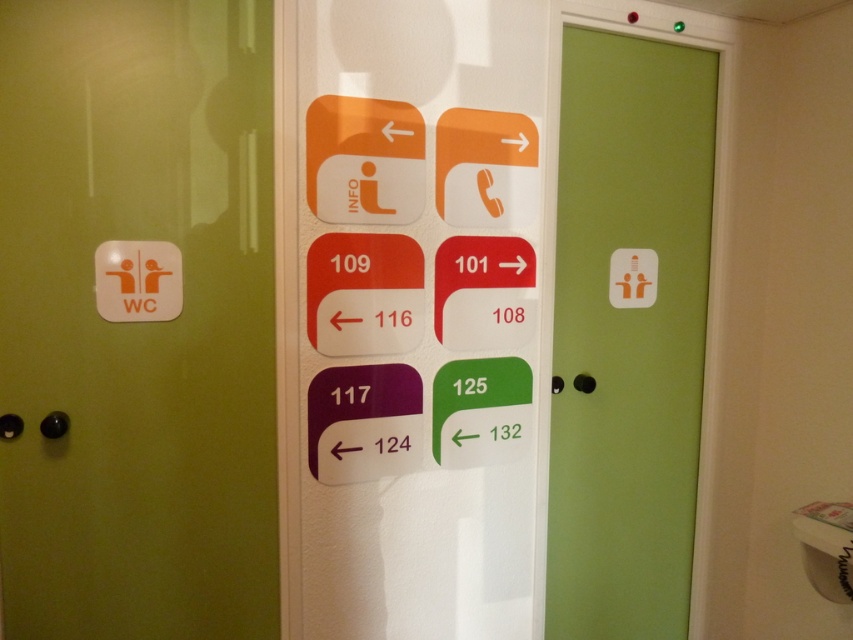
Between green matte wc sign at left and green matte door at center, which one has less height?

green matte wc sign at left is shorter.

Is green matte wc sign at left closer to the viewer compared to green matte door at center?

Yes, it is.

Is point (154, 436) closer to camera compared to point (619, 68)?

Yes, it is in front of point (619, 68).

Identify the location of green matte wc sign at left. (136, 320).